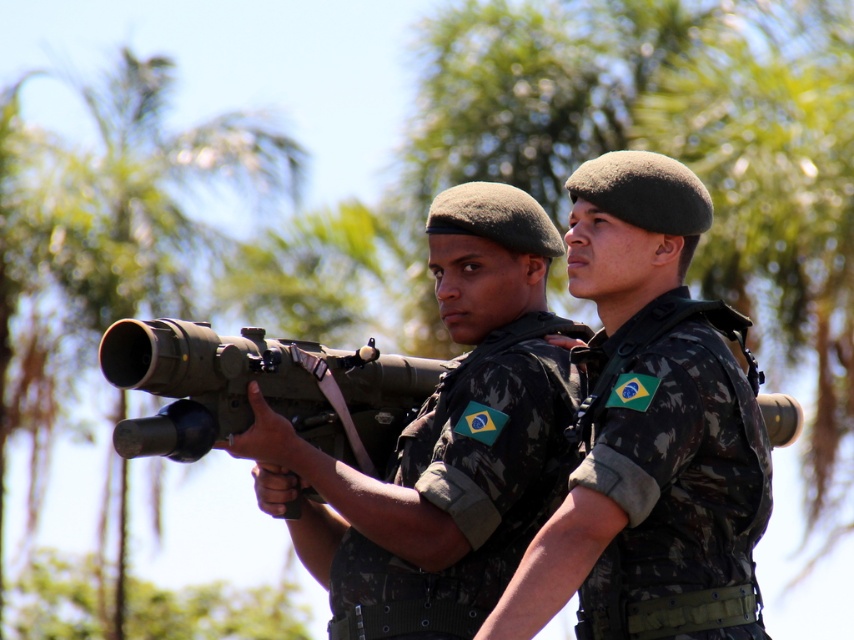
Between camo uniform at center and matte black rifle at center, which one is positioned lower?

matte black rifle at center is below.

Is camo uniform at center thinner than matte black rifle at center?

Incorrect, camo uniform at center's width is not less than matte black rifle at center's.

Where is `camo uniform at center`? Image resolution: width=854 pixels, height=640 pixels. camo uniform at center is located at coordinates (443, 440).

Does camouflage uniform at center appear under matte black rifle at center?

Incorrect, camouflage uniform at center is not positioned below matte black rifle at center.

Is camouflage uniform at center thinner than matte black rifle at center?

Yes, camouflage uniform at center is thinner than matte black rifle at center.

Is point (677, 193) in front of point (202, 358)?

No, it is behind (202, 358).

Identify the location of camouflage uniform at center. This screenshot has height=640, width=854. (646, 419).

What are the coordinates of `camouflage uniform at center` in the screenshot? It's located at (646, 419).

Based on the photo, is camouflage uniform at center above camo uniform at center?

No, camouflage uniform at center is not above camo uniform at center.

Measure the distance between camouflage uniform at center and camera.

camouflage uniform at center is 134.35 feet away from camera.

Identify the location of camouflage uniform at center. (646, 419).